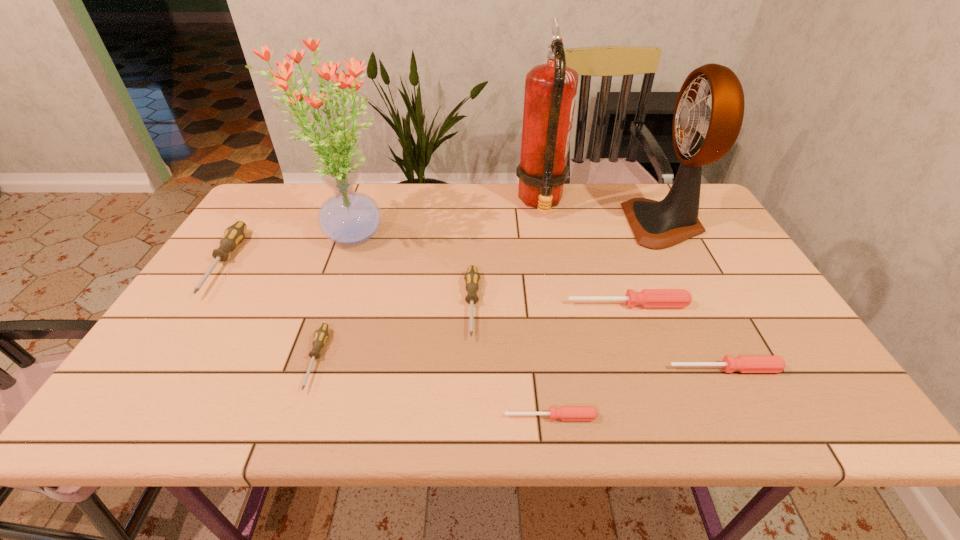
Image resolution: width=960 pixels, height=540 pixels. Identify the location of the closest screwdriver relative to the second gray screwdriver from right to left. (472, 278).

I want to click on gray screwdriver that is the third closest to the biggest red screwdriver, so click(234, 234).

The image size is (960, 540). I want to click on gray screwdriver object that ranks as the third closest to the red flower arrangement, so click(321, 334).

Identify the location of red screwdriver that can be found as the closest to the fan. Image resolution: width=960 pixels, height=540 pixels. (648, 298).

At what (x,y) coordinates should I click in order to perform the action: click on red screwdriver that is the second closest to the farthest red screwdriver. Please return your answer as a coordinate pair (x, y). The image size is (960, 540). Looking at the image, I should click on (566, 413).

At what (x,y) coordinates should I click in order to perform the action: click on free location that satisfies the following two spatial constraints: 1. on the back side of the second biggest red screwdriver; 2. on the left side of the nearest object. Please return your answer as a coordinate pair (x, y). The image size is (960, 540). Looking at the image, I should click on (544, 369).

The image size is (960, 540). Identify the location of vacant region that satisfies the following two spatial constraints: 1. at the nozzle of the red fire extinguisher; 2. at the tip of the second screwdriver from left to right. (570, 360).

This screenshot has width=960, height=540. In order to click on vacant region that satisfies the following two spatial constraints: 1. on the front side of the red flower arrangement; 2. on the right side of the second biggest red screwdriver in this screenshot , I will do `click(300, 369)`.

Where is `vacant space that satisfies the following two spatial constraints: 1. at the tip of the nearest object; 2. on the right side of the leftmost gray screwdriver`? vacant space that satisfies the following two spatial constraints: 1. at the tip of the nearest object; 2. on the right side of the leftmost gray screwdriver is located at coordinates (122, 417).

Where is `blank area in the image that satisfies the following two spatial constraints: 1. on the back side of the second smallest red screwdriver; 2. at the nozzle of the fire extinguisher`? blank area in the image that satisfies the following two spatial constraints: 1. on the back side of the second smallest red screwdriver; 2. at the nozzle of the fire extinguisher is located at coordinates (641, 202).